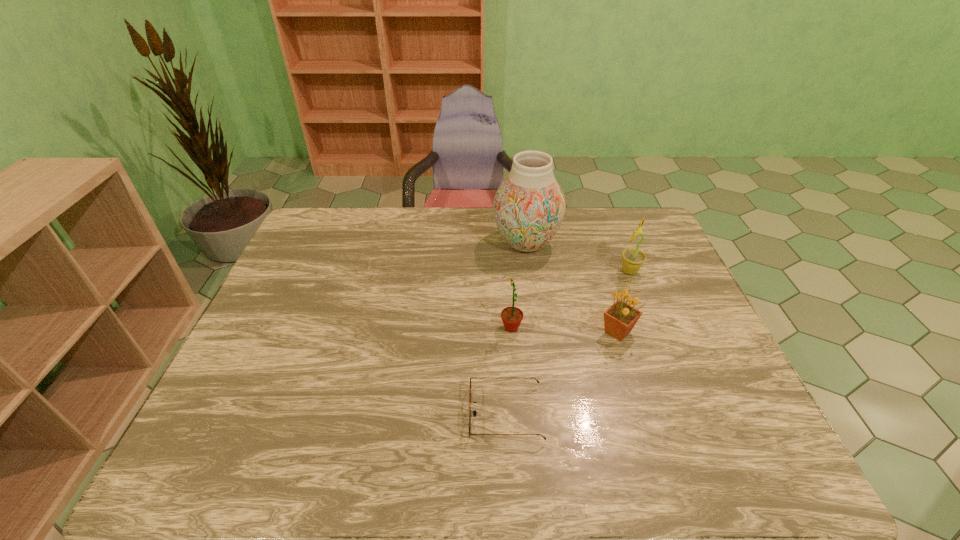
You are a GUI agent. You are given a task and a screenshot of the screen. Output one action in this format:
    pyautogui.click(x=<x>, y=<y>)
    Task: Click on the object that is positioned at the right edge
    The height and width of the screenshot is (540, 960).
    Given the screenshot: What is the action you would take?
    click(x=632, y=259)

In order to click on vacant space at the far edge of the desktop in this screenshot , I will do `click(378, 211)`.

Locate an element on the screen. free space at the left edge of the desktop is located at coordinates (235, 406).

The height and width of the screenshot is (540, 960). Find the location of `vacant space at the right edge of the desktop`. vacant space at the right edge of the desktop is located at coordinates (649, 312).

In the image, there is a desktop. Find the location of `vacant space at the far left corner`. vacant space at the far left corner is located at coordinates (320, 233).

In the image, there is a desktop. Where is `vacant space at the far right corner`? Image resolution: width=960 pixels, height=540 pixels. vacant space at the far right corner is located at coordinates (642, 246).

Locate an element on the screen. The image size is (960, 540). free spot at the near right corner of the desktop is located at coordinates (737, 475).

Where is `vacant area that lies between the second object from right to left and the shortest object`? The image size is (960, 540). vacant area that lies between the second object from right to left and the shortest object is located at coordinates (562, 373).

This screenshot has height=540, width=960. I want to click on empty location between the leftmost sunflower and the second sunflower from right to left, so click(x=564, y=330).

This screenshot has height=540, width=960. What are the coordinates of `free spot between the second sunflower from right to left and the nearest object` in the screenshot? It's located at (562, 373).